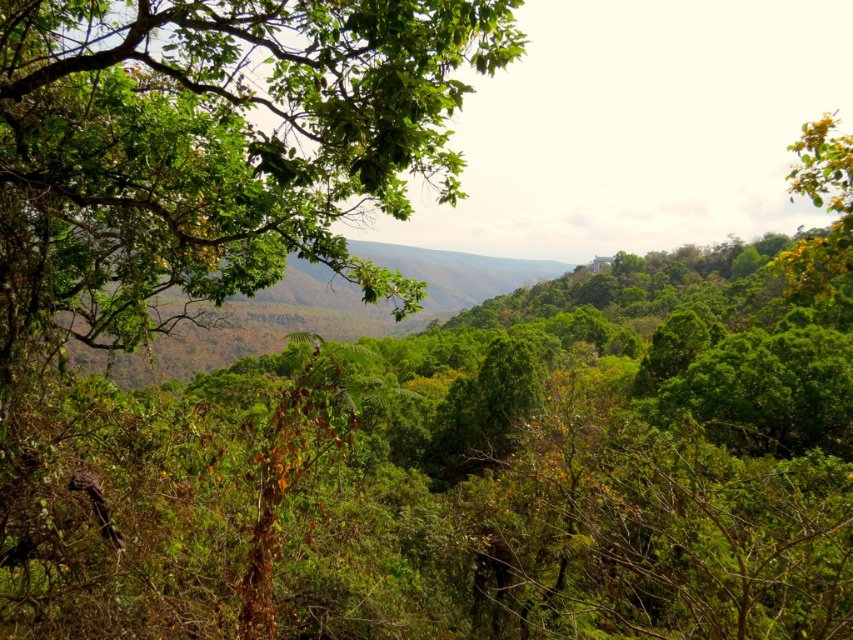
Describe the element at coordinates (213, 147) in the screenshot. The height and width of the screenshot is (640, 853). I see `green leafy tree at upper left` at that location.

Between point (102, 115) and point (827, 266), which one is positioned in front?

Point (827, 266) is in front.

At what (x,y) coordinates should I click in order to perform the action: click on green leafy tree at upper left. Please return your answer as a coordinate pair (x, y). Looking at the image, I should click on (213, 147).